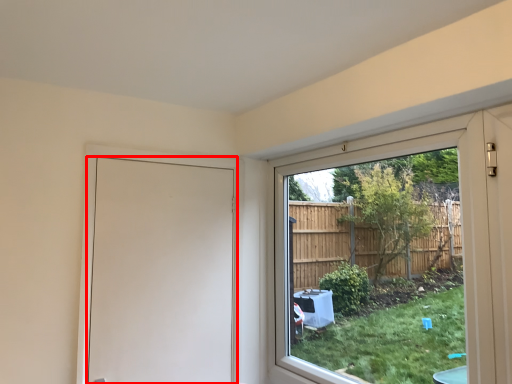
Question: From the image's perspective, considering the relative positions of door (annotated by the red box) and window in the image provided, where is door (annotated by the red box) located with respect to the staircase?

Choices:
 (A) below
 (B) above

Answer: (A)